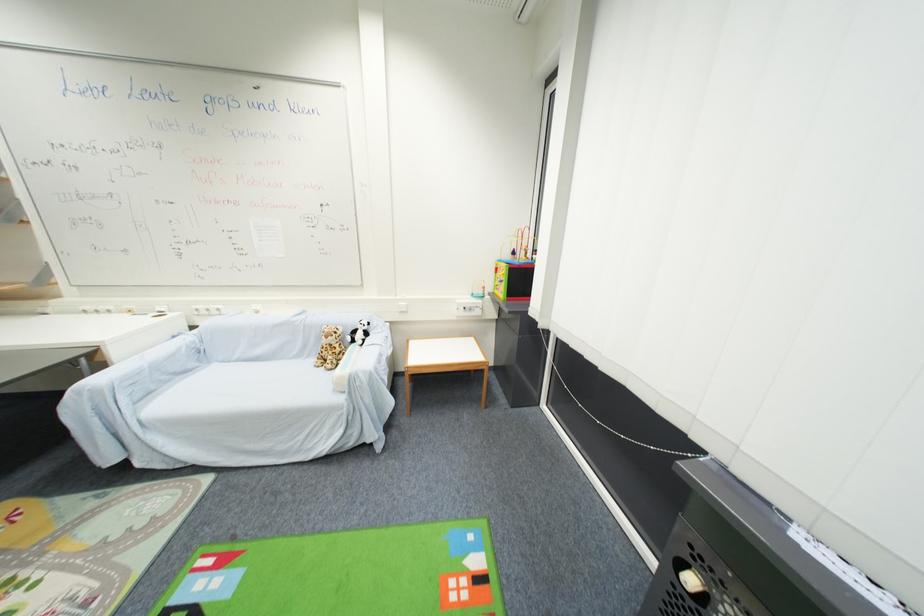
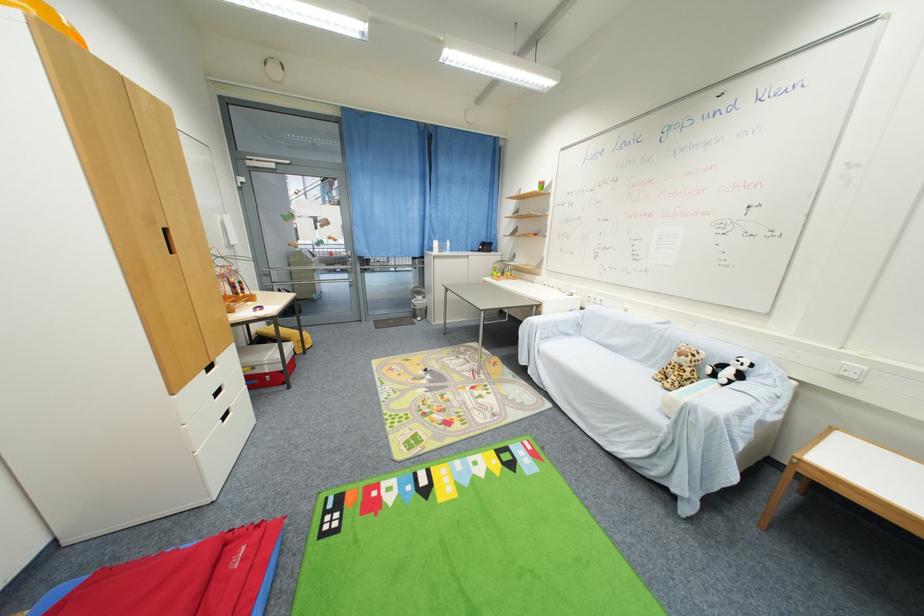
The point at [367,377] is marked in the first image. Where is the corresponding point in the second image?

(706, 415)